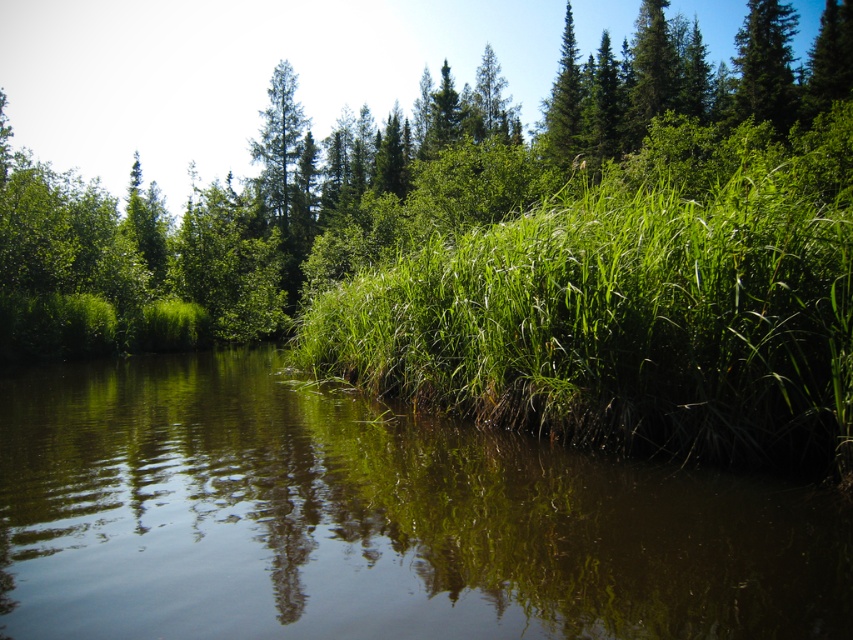
You are standing at the edge of the green grassy river at center and want to reach the green matte tree at upper right. Which direction should you move to get closer to the tree?

The green grassy river at center has a smaller size compared to green matte tree at upper right, so you should move towards the upper right direction to get closer to the green matte tree at upper right.

You are a landscape architect planning to install a walking path between the green grassy at center and the green matte tree at upper right. The path must be exactly 150 feet long. Can the path be installed without extending beyond the current scene?

The distance between the green grassy at center and the green matte tree at upper right is 167.09 feet. Since the required path length is 150 feet, which is shorter than the actual distance, the path can be installed within the current scene without needing to extend beyond it.

You are a photographer planning to capture the entire scene in one shot. Given that your camera can only focus on objects within a 10m width, will the green grassy at center and the green matte tree at upper right fit within the frame without cropping?

The green grassy at center is wider than the green matte tree at upper right. Since the total width of both objects combined may exceed the camera frame limit of 10m, it is uncertain if they will fit without cropping. Further information on individual widths is needed.